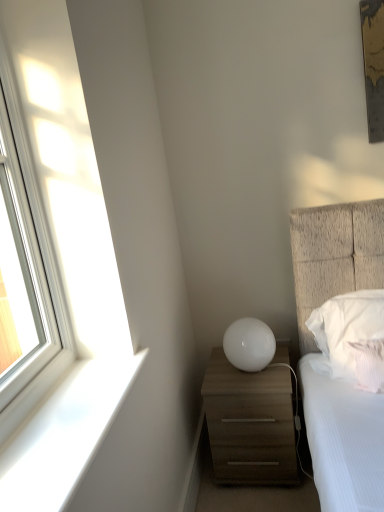
Question: Considering the positions of clear glass window at left and white soft pillow at right, the second pillow from the front, in the image, is clear glass window at left wider or thinner than white soft pillow at right, the second pillow from the front,?

Choices:
 (A) wide
 (B) thin

Answer: (B)

Question: From a real-world perspective, relative to white soft pillow at right, placed as the first pillow when sorted from back to front, is clear glass window at left vertically above or below?

Choices:
 (A) below
 (B) above

Answer: (B)

Question: Which object is the farthest from the white textured pillow at right, which is the second pillow from back to front?

Choices:
 (A) clear glass window at left
 (B) white glossy sphere at center
 (C) white soft pillow at right, the second pillow from the front
 (D) matte wood chest of drawers at lower right
 (E) white glossy window sill at left

Answer: (A)

Question: Which object is positioned closest to the matte wood chest of drawers at lower right?

Choices:
 (A) white textured pillow at right, which is the second pillow from back to front
 (B) white glossy sphere at center
 (C) white glossy window sill at left
 (D) white soft pillow at right, placed as the first pillow when sorted from back to front
 (E) clear glass window at left

Answer: (B)